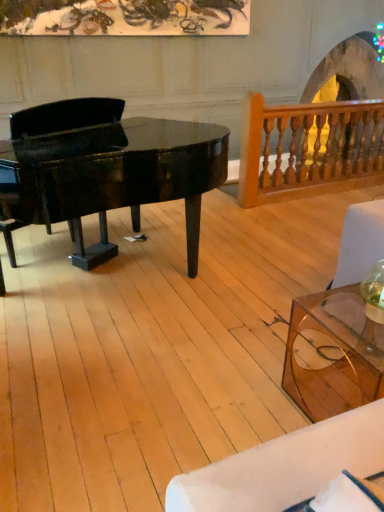
The image size is (384, 512). Describe the element at coordinates (113, 176) in the screenshot. I see `glossy black piano at left` at that location.

Where is `glossy black piano at left`? Image resolution: width=384 pixels, height=512 pixels. glossy black piano at left is located at coordinates (113, 176).

Considering the relative sizes of glossy black piano at left and transparent glass coffee table at lower right in the image provided, is glossy black piano at left shorter than transparent glass coffee table at lower right?

No, glossy black piano at left is not shorter than transparent glass coffee table at lower right.

Between glossy black piano at left and transparent glass coffee table at lower right, which one has smaller size?

transparent glass coffee table at lower right is smaller.

Where is `piano above the transparent glass coffee table at lower right (from the image's perspective)`? Image resolution: width=384 pixels, height=512 pixels. piano above the transparent glass coffee table at lower right (from the image's perspective) is located at coordinates (113, 176).

From the image's perspective, is glossy black piano at left under transparent glass coffee table at lower right?

Incorrect, from the image's perspective, glossy black piano at left is higher than transparent glass coffee table at lower right.

You are a GUI agent. You are given a task and a screenshot of the screen. Output one action in this format:
    pyautogui.click(x=<x>, y=<y>)
    Task: Click on the rail located behind the transparent glass coffee table at lower right
    This screenshot has height=512, width=384.
    Given the screenshot: What is the action you would take?
    pyautogui.click(x=312, y=149)

How different are the orientations of transparent glass coffee table at lower right and wooden baluster at upper right in degrees?

They differ by 1.22 degrees in their facing directions.

Can you confirm if transparent glass coffee table at lower right is shorter than wooden baluster at upper right?

Yes, transparent glass coffee table at lower right is shorter than wooden baluster at upper right.

Which is correct: transparent glass coffee table at lower right is inside wooden baluster at upper right, or outside of it?

transparent glass coffee table at lower right is outside wooden baluster at upper right.

From the image's perspective, is transparent glass coffee table at lower right located beneath glossy black piano at left?

Indeed, from the image's perspective, transparent glass coffee table at lower right is shown beneath glossy black piano at left.

Would you say transparent glass coffee table at lower right is outside glossy black piano at left?

Yes.

From a real-world perspective, is transparent glass coffee table at lower right physically above glossy black piano at left?

No, from a real-world perspective, transparent glass coffee table at lower right is not over glossy black piano at left

Which of these two, transparent glass coffee table at lower right or glossy black piano at left, stands shorter?

transparent glass coffee table at lower right.

In the scene shown: Which object is positioned more to the right, wooden baluster at upper right or glossy black piano at left?

Positioned to the right is wooden baluster at upper right.

Which is behind, wooden baluster at upper right or glossy black piano at left?

wooden baluster at upper right.

Which is closer, (307, 149) or (164, 194)?

Point (307, 149) is farther from the camera than point (164, 194).

Is wooden baluster at upper right closer to camera compared to transparent glass coffee table at lower right?

No, it is not.

Is transparent glass coffee table at lower right located within wooden baluster at upper right?

No, transparent glass coffee table at lower right is not surrounded by wooden baluster at upper right.

Are glossy black piano at left and wooden baluster at upper right beside each other?

No, glossy black piano at left is not with wooden baluster at upper right.

Which of these two, glossy black piano at left or wooden baluster at upper right, stands taller?

Standing taller between the two is glossy black piano at left.

Between glossy black piano at left and wooden baluster at upper right, which one has smaller size?

With smaller size is wooden baluster at upper right.

Locate an element on the screen. This screenshot has height=512, width=384. coffee table that is on the right side of glossy black piano at left is located at coordinates (332, 354).

At what (x,y) coordinates should I click in order to perform the action: click on rail that is above the transparent glass coffee table at lower right (from a real-world perspective). Please return your answer as a coordinate pair (x, y). Image resolution: width=384 pixels, height=512 pixels. Looking at the image, I should click on pos(312,149).

Looking at this image, looking at the image, which one is located further to glossy black piano at left, wooden baluster at upper right or transparent glass coffee table at lower right?

The object further to glossy black piano at left is wooden baluster at upper right.

Estimate the real-world distances between objects in this image. Which object is further from transparent glass coffee table at lower right, glossy black piano at left or wooden baluster at upper right?

The object further to transparent glass coffee table at lower right is wooden baluster at upper right.

Estimate the real-world distances between objects in this image. Which object is closer to glossy black piano at left, transparent glass coffee table at lower right or wooden baluster at upper right?

transparent glass coffee table at lower right lies closer to glossy black piano at left than the other object.

Looking at the image, which one is located further to transparent glass coffee table at lower right, wooden baluster at upper right or glossy black piano at left?

The object further to transparent glass coffee table at lower right is wooden baluster at upper right.

Considering their positions, is glossy black piano at left positioned further to wooden baluster at upper right than transparent glass coffee table at lower right?

Among the two, transparent glass coffee table at lower right is located further to wooden baluster at upper right.

Looking at the image, which one is located further to wooden baluster at upper right, transparent glass coffee table at lower right or glossy black piano at left?

Among the two, transparent glass coffee table at lower right is located further to wooden baluster at upper right.

In order to click on piano between transparent glass coffee table at lower right and wooden baluster at upper right from front to back in this screenshot , I will do `click(113, 176)`.